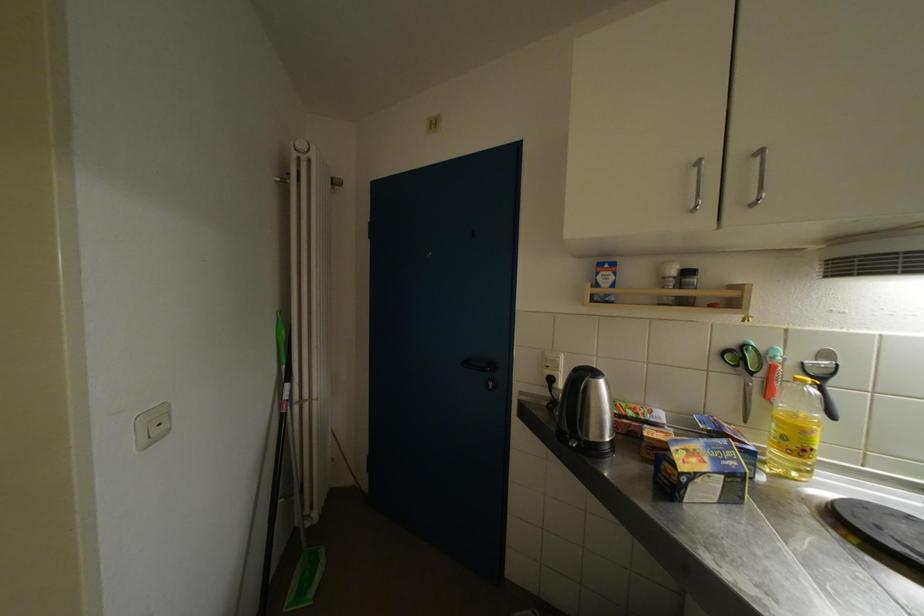
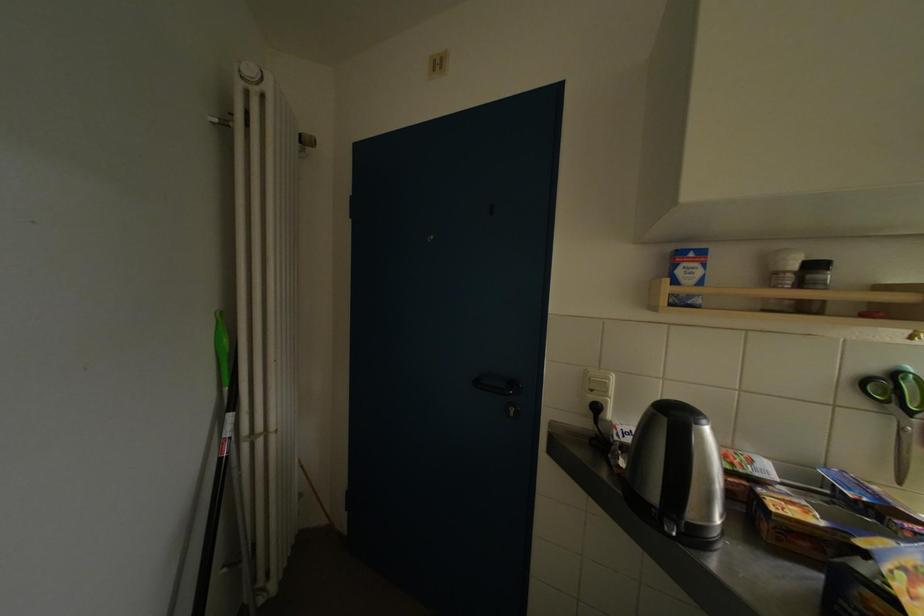
Where in the second image is the point corresponding to pixel 752 389 from the first image?

(908, 434)